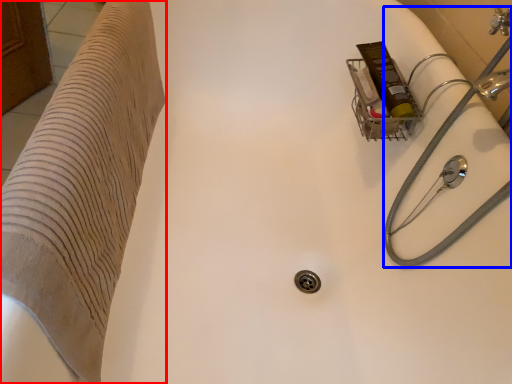
Question: Which object appears closest to the camera in this image, furniture (highlighted by a red box) or water pipe (highlighted by a blue box)?

Choices:
 (A) furniture
 (B) water pipe

Answer: (A)